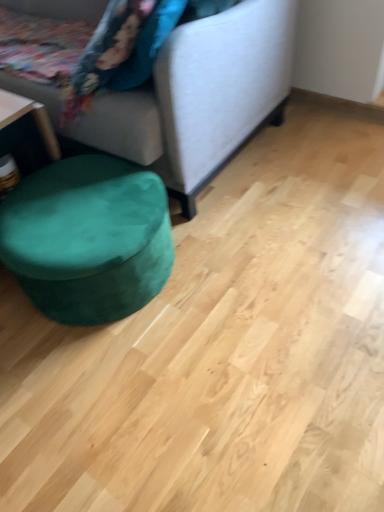
Locate an element on the screen. This screenshot has height=512, width=384. free location to the right of velvet green ottoman at lower left is located at coordinates (243, 258).